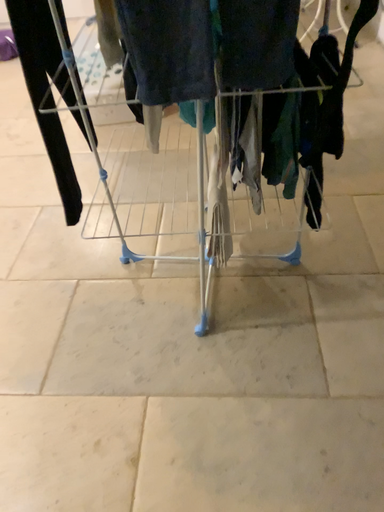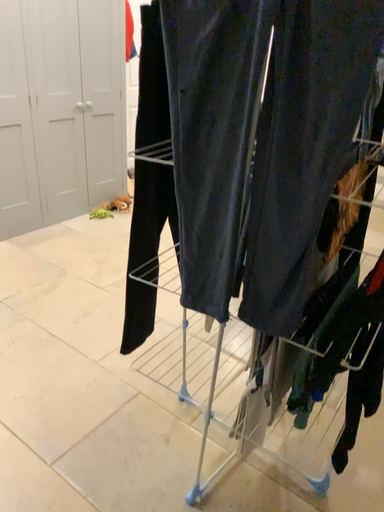
Question: Which way did the camera rotate in the video?

Choices:
 (A) rotated downward
 (B) rotated upward

Answer: (B)